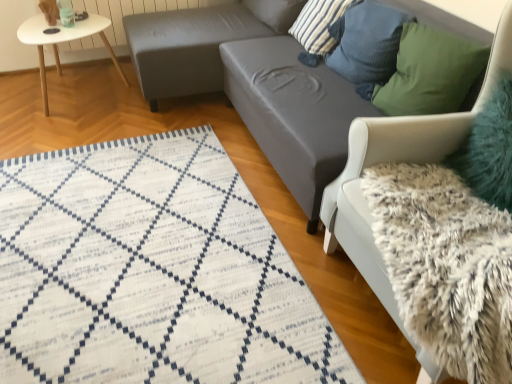
Question: Can you confirm if striped fabric pillow at upper center, which is the 1th pillow from back to front, is bigger than teal fuzzy pillow at upper right, the fifth pillow when ordered from back to front?

Choices:
 (A) yes
 (B) no

Answer: (A)

Question: Does striped fabric pillow at upper center, which ranks as the fifth pillow in front-to-back order, have a lesser height compared to teal fuzzy pillow at upper right, the fifth pillow when ordered from back to front?

Choices:
 (A) yes
 (B) no

Answer: (A)

Question: Is striped fabric pillow at upper center, which ranks as the fifth pillow in front-to-back order, to the right of teal fuzzy pillow at upper right, the fifth pillow when ordered from back to front, from the viewer's perspective?

Choices:
 (A) yes
 (B) no

Answer: (B)

Question: Is striped fabric pillow at upper center, which ranks as the fifth pillow in front-to-back order, smaller than teal fuzzy pillow at upper right, the fifth pillow when ordered from back to front?

Choices:
 (A) yes
 (B) no

Answer: (B)

Question: Considering the relative sizes of striped fabric pillow at upper center, which ranks as the fifth pillow in front-to-back order, and teal fuzzy pillow at upper right, the fifth pillow when ordered from back to front, in the image provided, is striped fabric pillow at upper center, which ranks as the fifth pillow in front-to-back order, wider than teal fuzzy pillow at upper right, the fifth pillow when ordered from back to front,?

Choices:
 (A) yes
 (B) no

Answer: (A)

Question: Is teal fuzzy pillow at upper right, the fifth pillow when ordered from back to front, at the back of striped fabric pillow at upper center, which ranks as the fifth pillow in front-to-back order?

Choices:
 (A) no
 (B) yes

Answer: (A)

Question: Does teal glass at upper left come in front of green fabric pillow at upper right, which is the 4th pillow in back-to-front order?

Choices:
 (A) no
 (B) yes

Answer: (A)

Question: Is green fabric pillow at upper right, which is the 4th pillow in back-to-front order, completely or partially inside teal glass at upper left?

Choices:
 (A) yes
 (B) no

Answer: (B)

Question: Considering the relative sizes of teal glass at upper left and green fabric pillow at upper right, which is the 2th pillow from front to back, in the image provided, is teal glass at upper left taller than green fabric pillow at upper right, which is the 2th pillow from front to back,?

Choices:
 (A) yes
 (B) no

Answer: (B)

Question: From the image's perspective, is teal glass at upper left on top of green fabric pillow at upper right, which is the 2th pillow from front to back?

Choices:
 (A) no
 (B) yes

Answer: (B)

Question: Is teal glass at upper left further to the viewer compared to green fabric pillow at upper right, which is the 4th pillow in back-to-front order?

Choices:
 (A) no
 (B) yes

Answer: (B)

Question: Is teal glass at upper left smaller than green fabric pillow at upper right, which is the 4th pillow in back-to-front order?

Choices:
 (A) no
 (B) yes

Answer: (B)

Question: Is white glossy table at upper left taller than white woven mat at lower left?

Choices:
 (A) yes
 (B) no

Answer: (A)